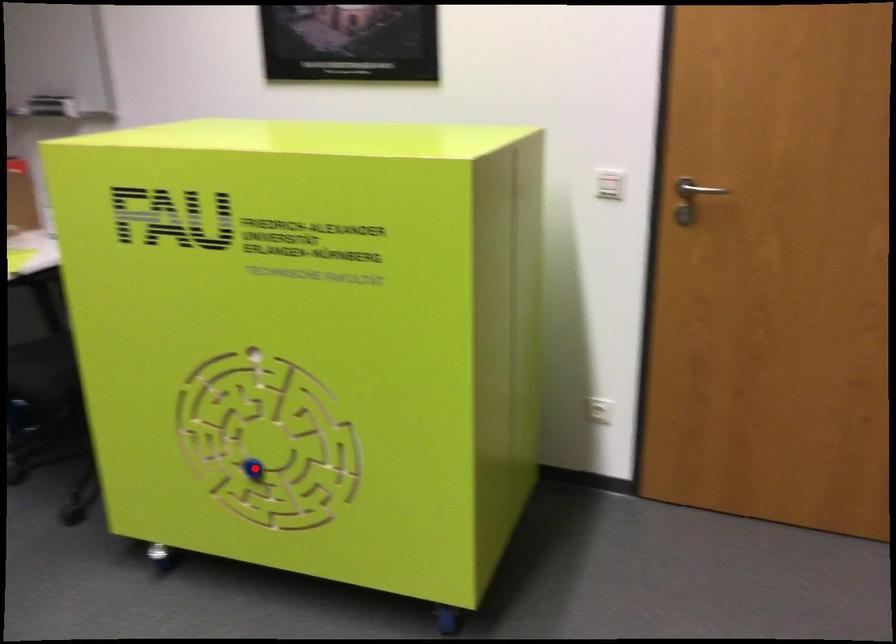
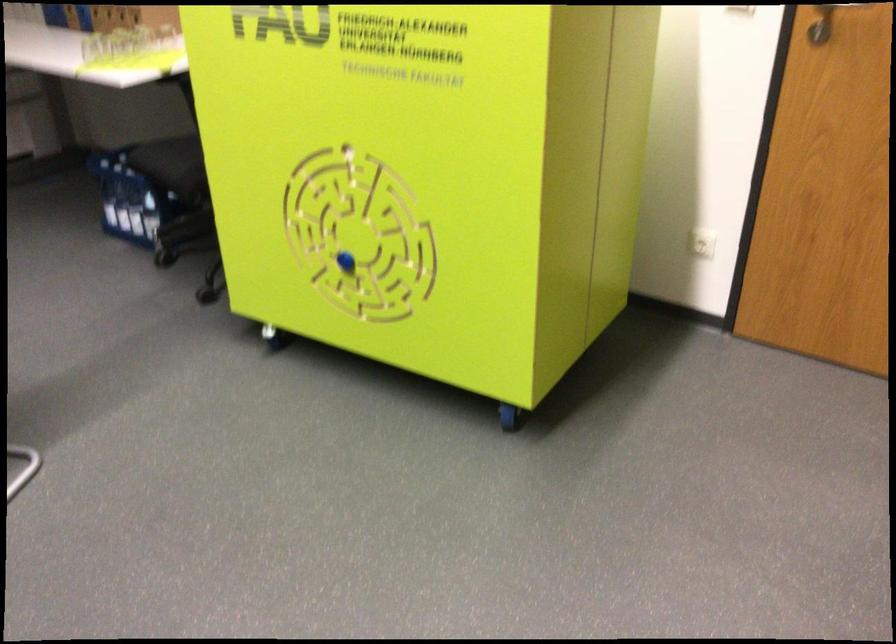
Question: I am providing you with two images of the same scene from different viewpoints. A red point is marked on the first image. Is the red point's position out of view in image 2?

Choices:
 (A) Yes
 (B) No

Answer: (B)